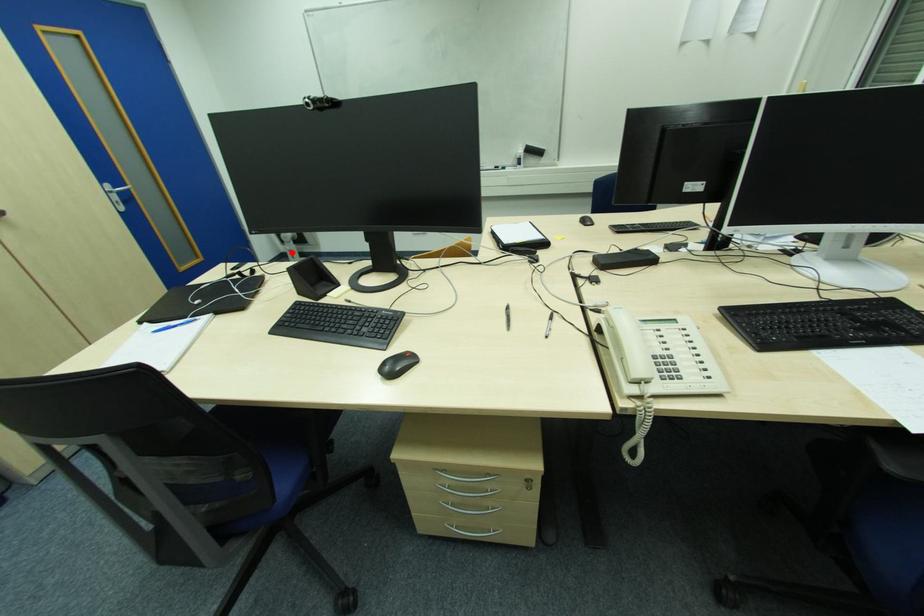
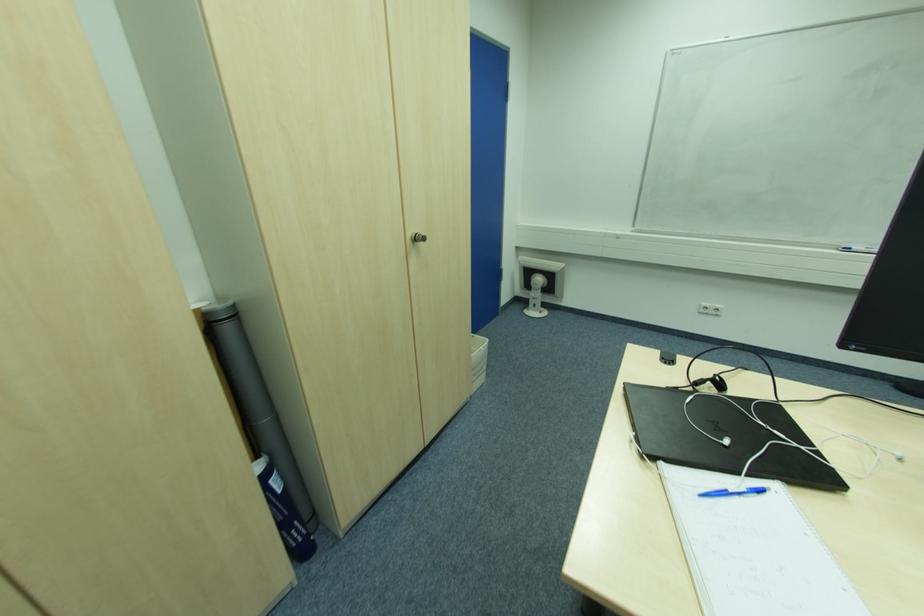
Locate, in the second image, the point that corresponds to the highlighted location in the first image.

(536, 300)